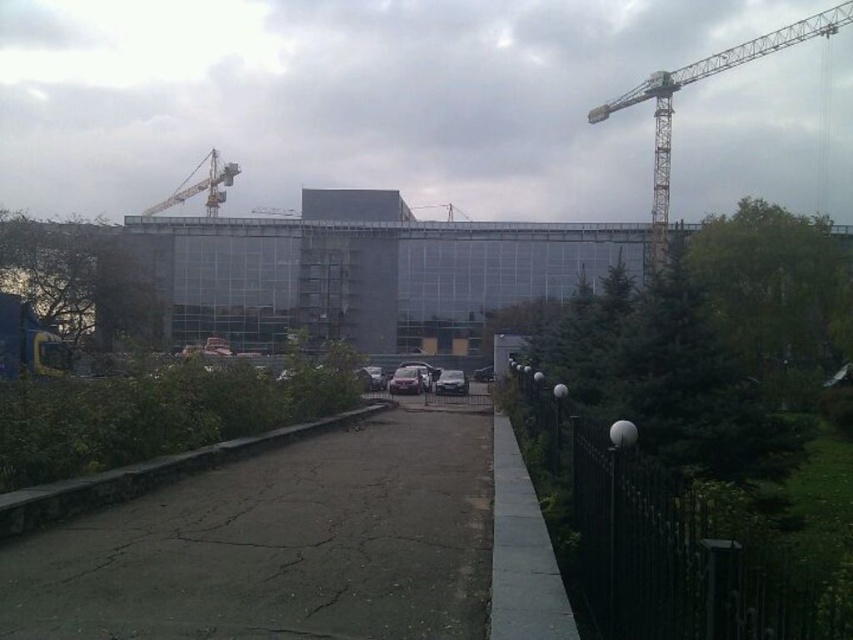
Question: Can you confirm if metallic yellow crane at upper left is positioned below satin silver sedan at center?

Choices:
 (A) yes
 (B) no

Answer: (B)

Question: Which point is closer to the camera?

Choices:
 (A) metallic yellow crane at upper center
 (B) yellow metallic crane at upper right

Answer: (B)

Question: Is metallic yellow crane at upper left thinner than shiny silver car at center?

Choices:
 (A) no
 (B) yes

Answer: (A)

Question: Can you confirm if shiny silver car at center is positioned below metallic yellow crane at center?

Choices:
 (A) yes
 (B) no

Answer: (A)

Question: Which point is closer to the camera taking this photo?

Choices:
 (A) (454, 211)
 (B) (445, 387)

Answer: (B)

Question: Which of these objects is positioned closest to the yellow metallic crane at upper right?

Choices:
 (A) metallic yellow crane at upper center
 (B) metallic yellow crane at center

Answer: (B)